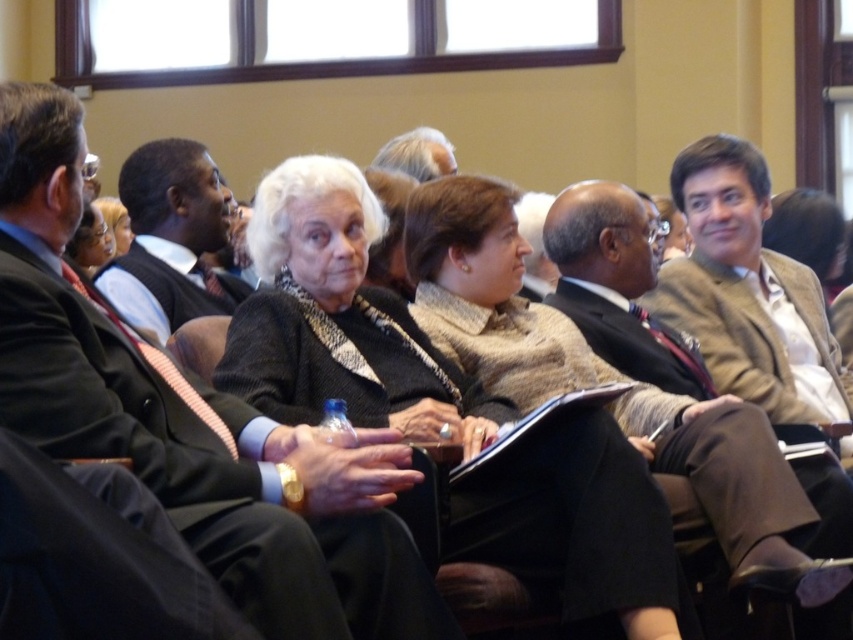
Does brown textured suit at center appear over light brown hair at upper center?

No.

Is brown textured suit at center to the right of light brown hair at upper center from the viewer's perspective?

Indeed, brown textured suit at center is positioned on the right side of light brown hair at upper center.

Does point (607, 298) come behind point (415, 156)?

That is False.

Locate an element on the screen. Image resolution: width=853 pixels, height=640 pixels. brown textured suit at center is located at coordinates (618, 288).

Which is in front, point (144, 394) or point (399, 410)?

Point (144, 394)

Describe the element at coordinates (193, 422) in the screenshot. I see `matte black suit at center` at that location.

Where is `matte black suit at center`? This screenshot has width=853, height=640. matte black suit at center is located at coordinates (193, 422).

Between point (582, 513) and point (674, 364), which one is positioned in front?

Positioned in front is point (582, 513).

Can you confirm if dark gray wool sweater at center is wider than brown textured suit at center?

Yes, dark gray wool sweater at center is wider than brown textured suit at center.

From the picture: Who is more distant from viewer, (x=376, y=392) or (x=663, y=336)?

Positioned behind is point (x=663, y=336).

This screenshot has height=640, width=853. What are the coordinates of `dark gray wool sweater at center` in the screenshot? It's located at (x=339, y=320).